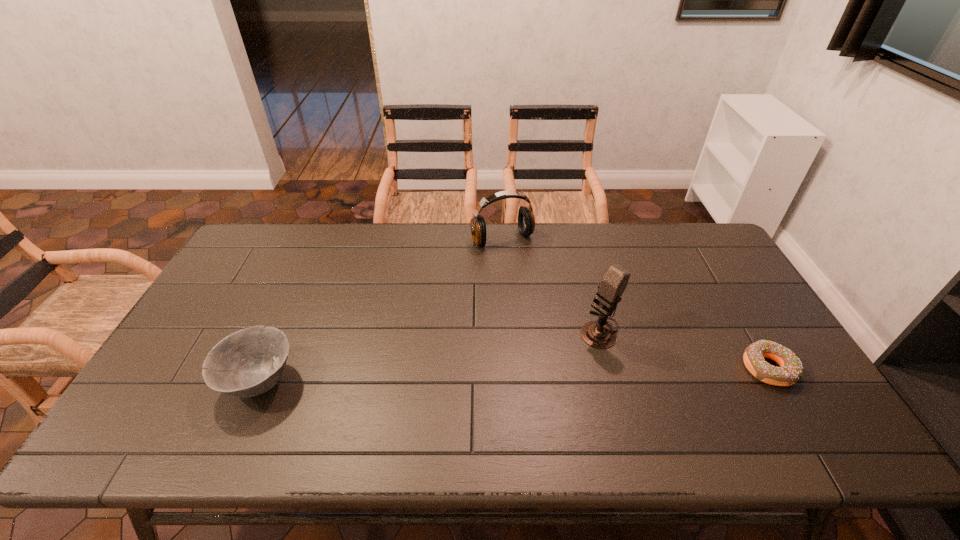
Locate an element on the screen. The width and height of the screenshot is (960, 540). the second shortest object is located at coordinates (249, 362).

Where is `the leftmost object`? the leftmost object is located at coordinates (249, 362).

This screenshot has width=960, height=540. Identify the location of doughnut. (790, 371).

Identify the location of the shortest object. (790, 371).

Image resolution: width=960 pixels, height=540 pixels. I want to click on microphone, so click(x=599, y=334).

Where is `the third object from left to right`? Image resolution: width=960 pixels, height=540 pixels. the third object from left to right is located at coordinates (599, 334).

Identify the location of the third shortest object. (526, 222).

Find the location of a particular element. The height and width of the screenshot is (540, 960). the third object from right to left is located at coordinates (526, 222).

Find the location of `vacant region located on the right of the second shortest object`. vacant region located on the right of the second shortest object is located at coordinates (408, 381).

The width and height of the screenshot is (960, 540). In order to click on free space located on the back of the shortest object in this screenshot , I will do `click(724, 292)`.